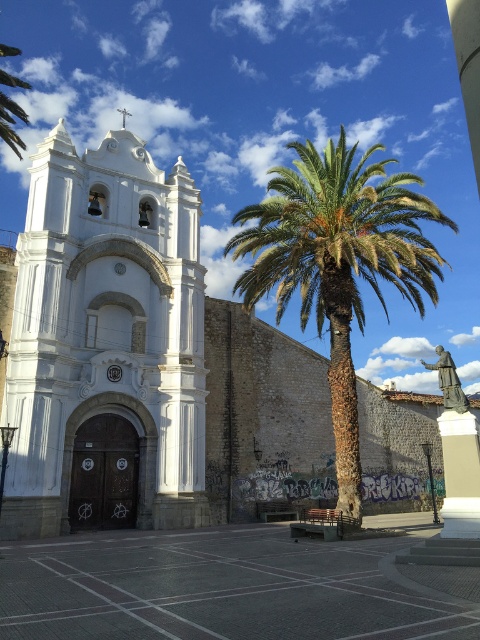
Who is lower down, green leafy palm at center or white stone statue at center?

white stone statue at center is lower down.

Can you confirm if green leafy palm at center is positioned to the right of white stone statue at center?

In fact, green leafy palm at center is to the left of white stone statue at center.

This screenshot has height=640, width=480. I want to click on green leafy palm at center, so click(337, 262).

The height and width of the screenshot is (640, 480). Identify the location of green leafy palm at center. (337, 262).

Does point (277, 588) come farther from viewer compared to point (302, 172)?

No, (277, 588) is closer to viewer.

Can you confirm if gray concrete plaza at center is taller than green leafy palm at center?

In fact, gray concrete plaza at center may be shorter than green leafy palm at center.

Measure the distance between point (427, 611) and camera.

The distance of point (427, 611) from camera is 10.97 meters.

The height and width of the screenshot is (640, 480). What are the coordinates of `gray concrete plaza at center` in the screenshot? It's located at (218, 589).

Who is shorter, white stone church at center or green leafy palm at center?

With less height is white stone church at center.

Can you confirm if white stone church at center is thinner than green leafy palm at center?

Yes.

In order to click on white stone church at center in this screenshot , I will do (x=127, y=349).